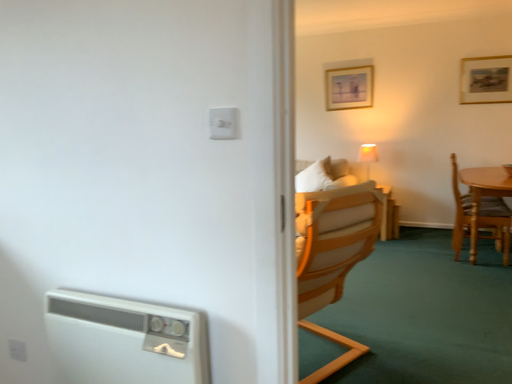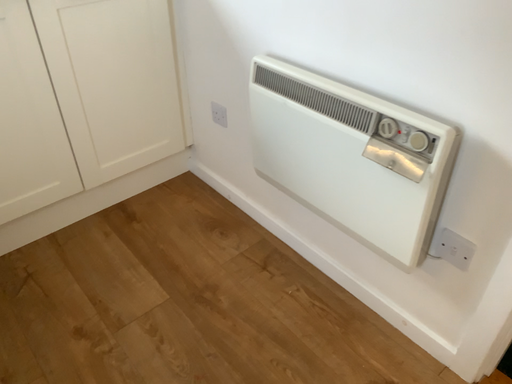
Question: How did the camera likely rotate when shooting the video?

Choices:
 (A) rotated downward
 (B) rotated upward

Answer: (A)